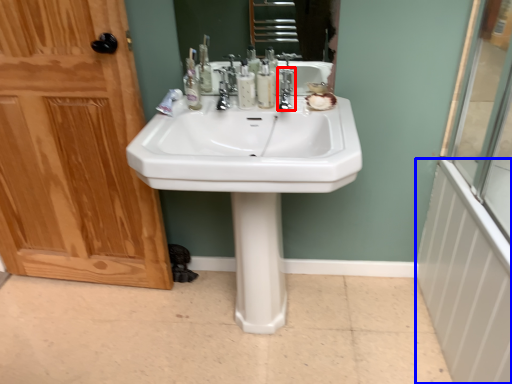
Question: Which point is further to the camera, faucet (highlighted by a red box) or radiator (highlighted by a blue box)?

Choices:
 (A) faucet
 (B) radiator

Answer: (A)